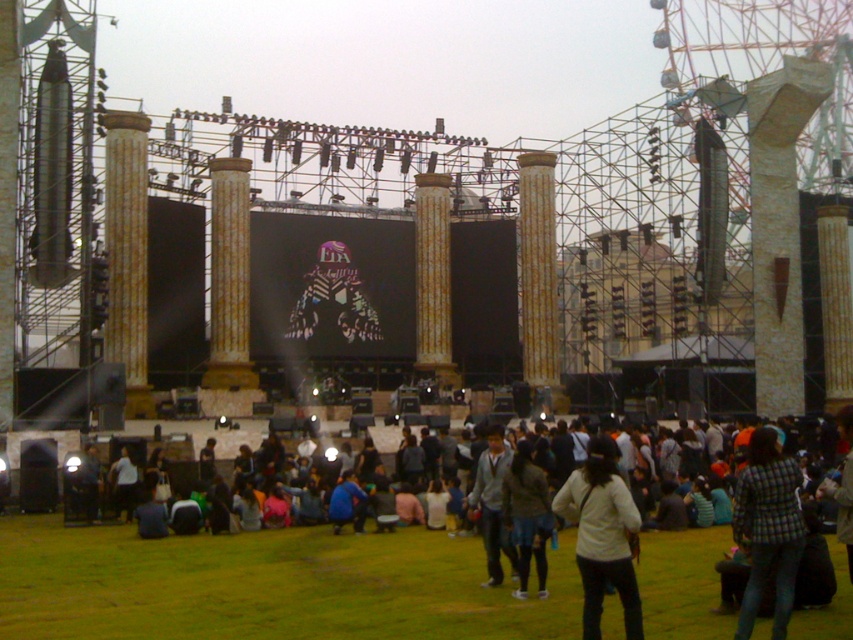
Between point (366, 593) and point (561, 515), which one is positioned behind?

The point (561, 515) is behind.

Does white casual clothing at center appear on the right side of white matte shirt at center?

In fact, white casual clothing at center is to the left of white matte shirt at center.

Describe the element at coordinates (273, 586) in the screenshot. I see `white casual clothing at center` at that location.

The height and width of the screenshot is (640, 853). I want to click on white casual clothing at center, so click(x=273, y=586).

Based on the photo, can you confirm if white matte shirt at center is shorter than dark gray fabric jacket at center?

In fact, white matte shirt at center may be taller than dark gray fabric jacket at center.

Which of these two, white matte shirt at center or dark gray fabric jacket at center, stands taller?

With more height is white matte shirt at center.

What do you see at coordinates (602, 536) in the screenshot?
I see `white matte shirt at center` at bounding box center [602, 536].

The image size is (853, 640). In order to click on white matte shirt at center in this screenshot , I will do `click(602, 536)`.

Who is positioned more to the right, dark gray fabric jacket at center or gray sweater at center?

dark gray fabric jacket at center is more to the right.

Can you confirm if dark gray fabric jacket at center is smaller than gray sweater at center?

Indeed, dark gray fabric jacket at center has a smaller size compared to gray sweater at center.

Does point (515, 465) lie in front of point (476, 474)?

Yes, point (515, 465) is in front of point (476, 474).

The width and height of the screenshot is (853, 640). I want to click on dark gray fabric jacket at center, so click(527, 516).